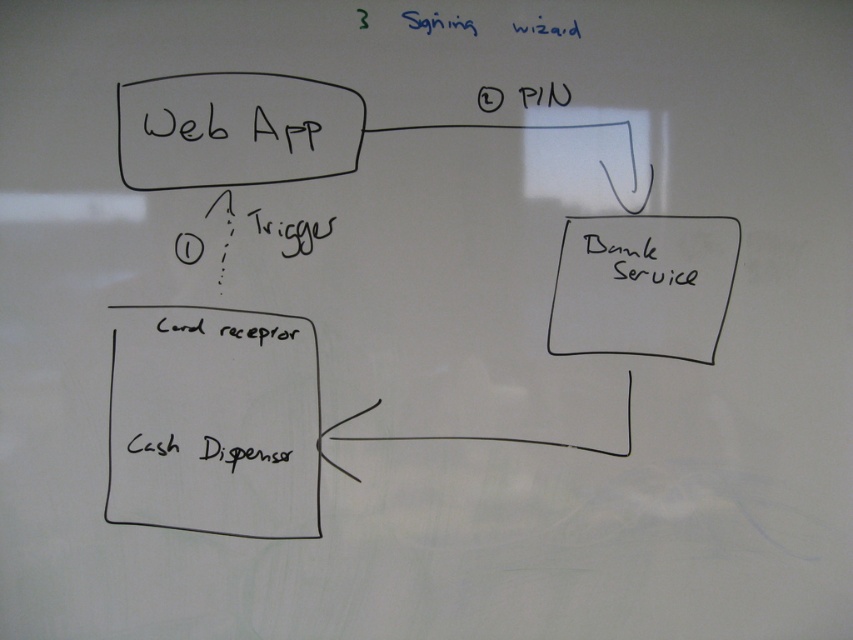
You are a project manager reviewing the whiteboard diagram. You need to update the notes on the black paper at upper right and the black handwritten text at center right. Which one can you fully see without moving closer because of its size?

The black paper at upper right can be fully seen without moving closer because it has a larger size compared to the black handwritten text at center right.

You are an analyst reviewing the whiteboard diagram. You notice two elements, the black paper at upper right and the black handwritten text at center right. Which element is positioned closer to the front of the whiteboard?

The black paper at upper right is closer to the viewer than the black handwritten text at center right, so it is positioned closer to the front of the whiteboard.